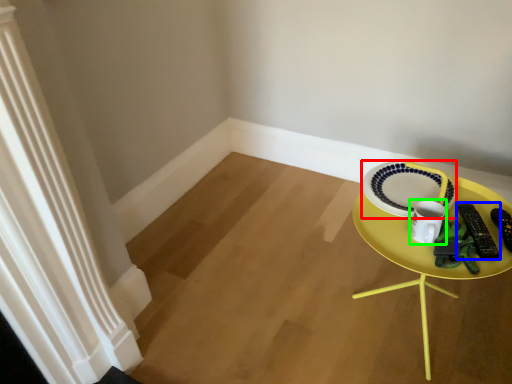
Question: Which is farther away from plate (highlighted by a red box)? remote control (highlighted by a blue box) or coffee cup (highlighted by a green box)?

Choices:
 (A) remote control
 (B) coffee cup

Answer: (A)